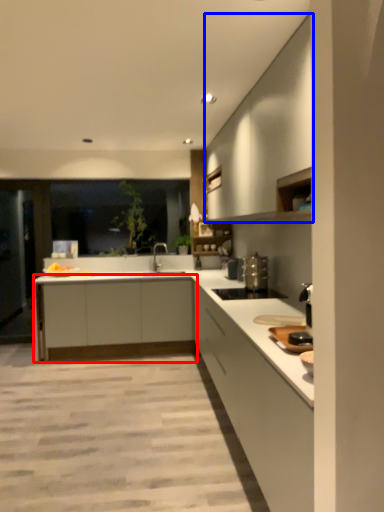
Question: Which object appears closest to the camera in this image, cabinetry (highlighted by a red box) or cabinetry (highlighted by a blue box)?

Choices:
 (A) cabinetry
 (B) cabinetry

Answer: (B)